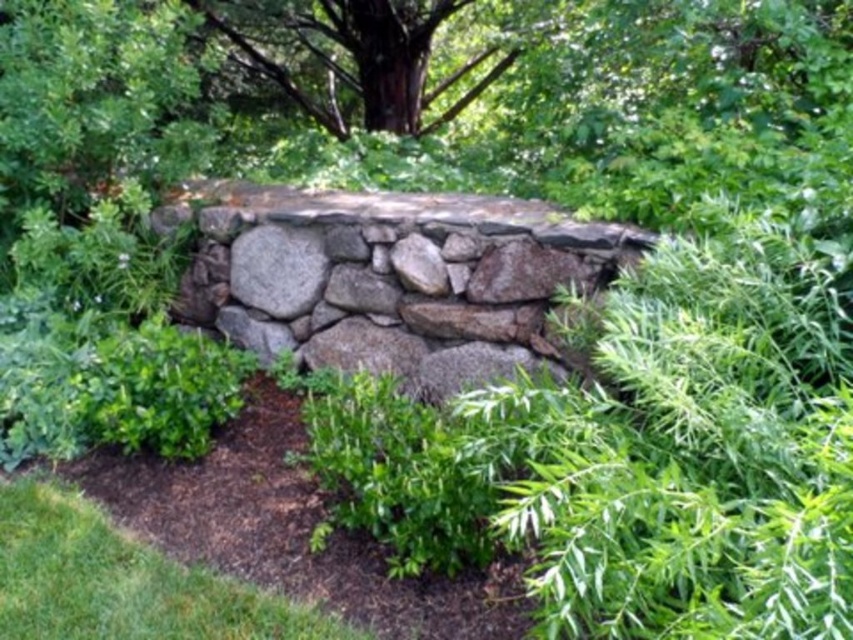
Question: Is the position of green leafy bush at center less distant than that of natural gray stone wall at center?

Choices:
 (A) no
 (B) yes

Answer: (B)

Question: Is green leafy bush at center in front of natural gray stone wall at center?

Choices:
 (A) no
 (B) yes

Answer: (B)

Question: Which of the following is the farthest from the observer?

Choices:
 (A) natural gray stone wall at center
 (B) green leafy bush at center

Answer: (A)

Question: Observing the image, what is the correct spatial positioning of green leafy bush at center in reference to natural gray stone wall at center?

Choices:
 (A) below
 (B) above

Answer: (A)